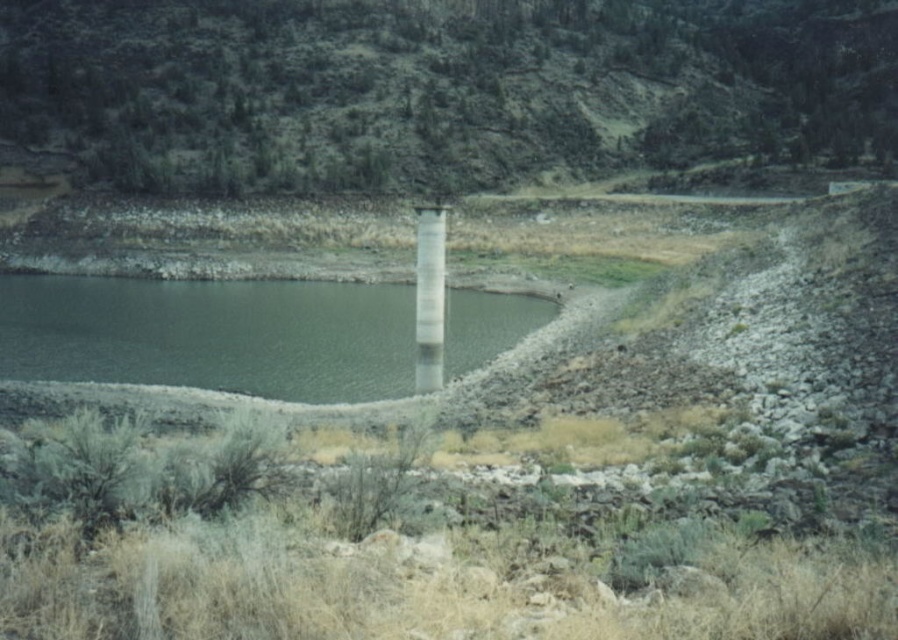
Question: Which point is farther from the camera taking this photo?

Choices:
 (A) (471, 132)
 (B) (436, 272)
 (C) (467, 368)

Answer: (A)

Question: Which point is closer to the camera?

Choices:
 (A) white glossy pillar at center
 (B) green grassy hillside at upper center
 (C) green concrete water at center left

Answer: (C)

Question: Is green concrete water at center left below white glossy pillar at center?

Choices:
 (A) no
 (B) yes

Answer: (B)

Question: Does green grassy hillside at upper center appear over green concrete water at center left?

Choices:
 (A) yes
 (B) no

Answer: (A)

Question: Is the position of green grassy hillside at upper center less distant than that of white glossy pillar at center?

Choices:
 (A) no
 (B) yes

Answer: (A)

Question: Which object is closer to the camera taking this photo?

Choices:
 (A) green concrete water at center left
 (B) green grassy hillside at upper center

Answer: (A)